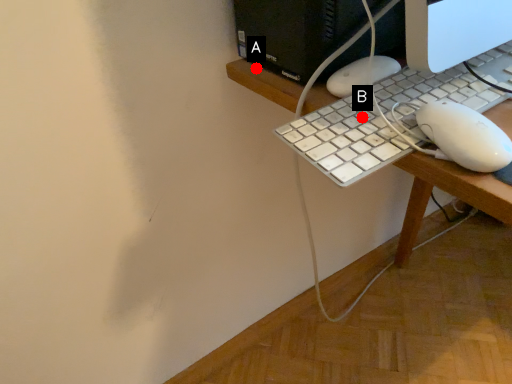
Question: Two points are circled on the image, labeled by A and B beside each circle. Which point appears closest to the camera in this image?

Choices:
 (A) A is closer
 (B) B is closer

Answer: (B)